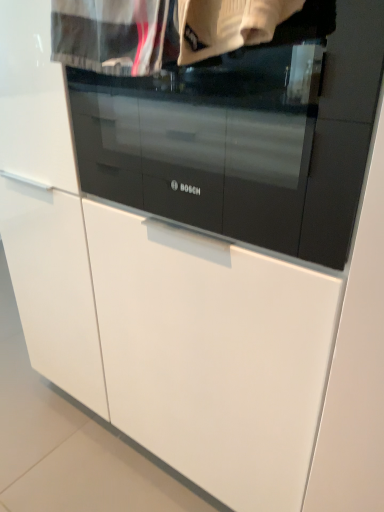
Question: From the image's perspective, is white knitted sweater at upper center, positioned as the 1th clothing in right-to-left order, above or below black glass oven at center?

Choices:
 (A) above
 (B) below

Answer: (A)

Question: Is white knitted sweater at upper center, positioned as the 2th clothing in left-to-right order, taller or shorter than black glass oven at center?

Choices:
 (A) short
 (B) tall

Answer: (A)

Question: Estimate the real-world distances between objects in this image. Which object is closer to the black glass oven at center?

Choices:
 (A) white cotton shirt at upper center, the first clothing positioned from the left
 (B) white knitted sweater at upper center, positioned as the 2th clothing in left-to-right order

Answer: (B)

Question: Estimate the real-world distances between objects in this image. Which object is farther from the white cotton shirt at upper center, the 2th clothing positioned from the right?

Choices:
 (A) white knitted sweater at upper center, positioned as the 1th clothing in right-to-left order
 (B) black glass oven at center

Answer: (B)